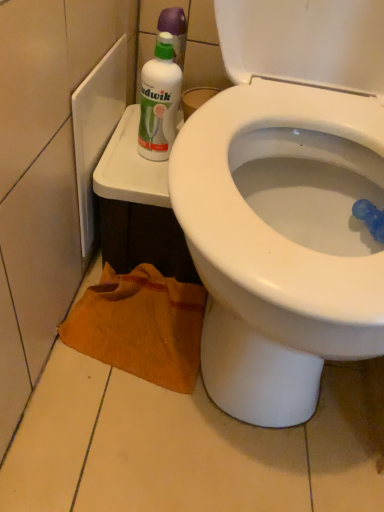
Question: Is white glossy bidet at upper right to the left of brown fabric towel at lower left from the viewer's perspective?

Choices:
 (A) yes
 (B) no

Answer: (B)

Question: Can you confirm if white glossy bidet at upper right is shorter than brown fabric towel at lower left?

Choices:
 (A) no
 (B) yes

Answer: (A)

Question: Can you confirm if white glossy bidet at upper right is taller than brown fabric towel at lower left?

Choices:
 (A) yes
 (B) no

Answer: (A)

Question: Is white glossy bidet at upper right looking in the opposite direction of brown fabric towel at lower left?

Choices:
 (A) no
 (B) yes

Answer: (A)

Question: Is white glossy bidet at upper right wider than brown fabric towel at lower left?

Choices:
 (A) no
 (B) yes

Answer: (B)

Question: From a real-world perspective, is white glossy bidet at upper right under brown fabric towel at lower left?

Choices:
 (A) no
 (B) yes

Answer: (A)

Question: From a real-world perspective, is white plastic bottle at upper left physically above brown fabric towel at lower left?

Choices:
 (A) no
 (B) yes

Answer: (B)

Question: Can you confirm if white plastic bottle at upper left is bigger than brown fabric towel at lower left?

Choices:
 (A) no
 (B) yes

Answer: (A)

Question: From a real-world perspective, is white plastic bottle at upper left positioned under brown fabric towel at lower left based on gravity?

Choices:
 (A) yes
 (B) no

Answer: (B)

Question: Is white plastic bottle at upper left oriented towards brown fabric towel at lower left?

Choices:
 (A) yes
 (B) no

Answer: (B)

Question: Is white plastic bottle at upper left directly adjacent to brown fabric towel at lower left?

Choices:
 (A) no
 (B) yes

Answer: (A)

Question: Is white plastic bottle at upper left behind brown fabric towel at lower left?

Choices:
 (A) no
 (B) yes

Answer: (A)

Question: From the image's perspective, does white plastic bottle at upper left appear higher than white glossy bidet at upper right?

Choices:
 (A) no
 (B) yes

Answer: (B)